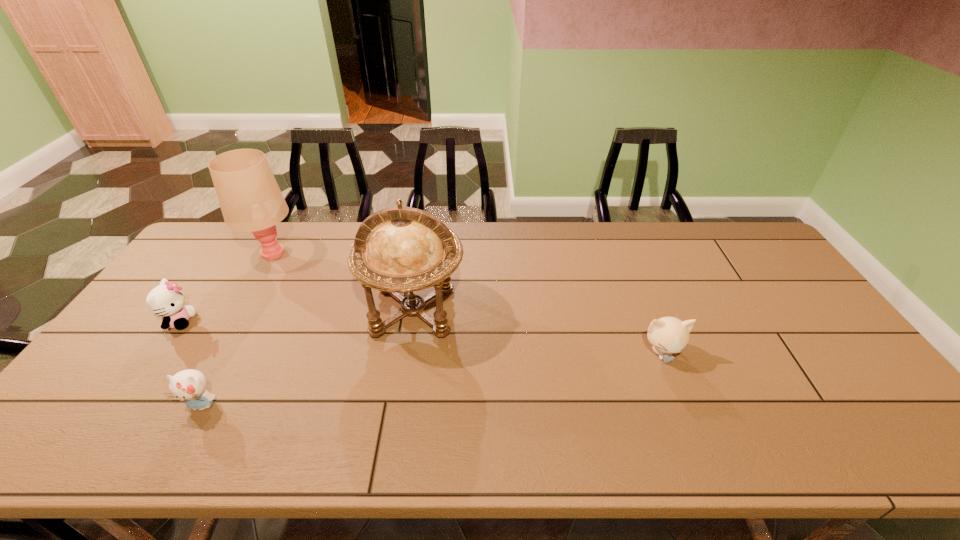
The height and width of the screenshot is (540, 960). In order to click on the fourth object from left to right in this screenshot , I will do `click(396, 250)`.

Locate an element on the screen. the farthest object is located at coordinates (250, 199).

What are the coordinates of `the leftmost kitten` in the screenshot? It's located at (166, 300).

This screenshot has height=540, width=960. I want to click on the leftmost object, so click(x=166, y=300).

Where is `the second farthest kitten`? The image size is (960, 540). the second farthest kitten is located at coordinates (667, 335).

Locate an element on the screen. the rightmost kitten is located at coordinates (667, 335).

Identify the location of the second kitten from right to left. This screenshot has height=540, width=960. (x=189, y=385).

Locate an element on the screen. the nearest kitten is located at coordinates (189, 385).

Identify the location of vacant space located 0.150m on the front-facing side of the globe. The width and height of the screenshot is (960, 540). (399, 399).

What are the coordinates of `vacant space located on the right of the lampshade` in the screenshot? It's located at (409, 254).